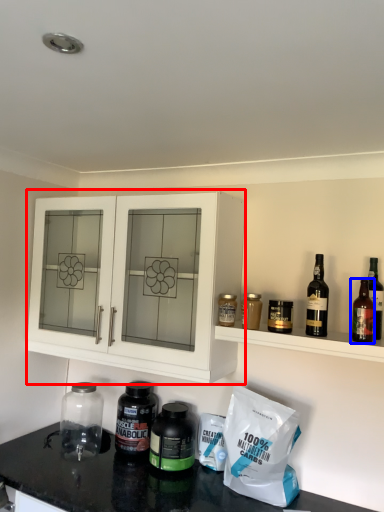
Question: Which object appears farthest to the camera in this image, cabinetry (highlighted by a red box) or wine bottle (highlighted by a blue box)?

Choices:
 (A) cabinetry
 (B) wine bottle

Answer: (A)